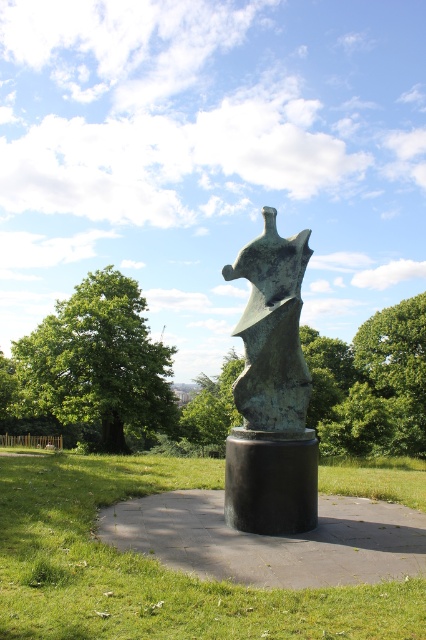
Can you confirm if green grass at center is shorter than green leafy tree at center?

Yes, green grass at center is shorter than green leafy tree at center.

Is green grass at center below green leafy tree at center?

Yes.

Which is behind, point (68, 452) or point (232, 401)?

The point (232, 401) is behind.

Where is `green grass at center`? This screenshot has width=426, height=640. green grass at center is located at coordinates (154, 566).

Between point (71, 600) and point (290, 275), which one is positioned behind?

Positioned behind is point (290, 275).

Between green grass at center and green patina sculpture at center, which one has less height?

With less height is green patina sculpture at center.

This screenshot has height=640, width=426. I want to click on green grass at center, so (x=154, y=566).

Where is `green grass at center`? This screenshot has height=640, width=426. green grass at center is located at coordinates (154, 566).

Is point (337, 621) positioned in front of point (40, 337)?

Yes, it is in front of point (40, 337).

Is green grass at center smaller than green leafy tree at left?

Yes, green grass at center is smaller than green leafy tree at left.

Identify the location of green grass at center. This screenshot has width=426, height=640. (154, 566).